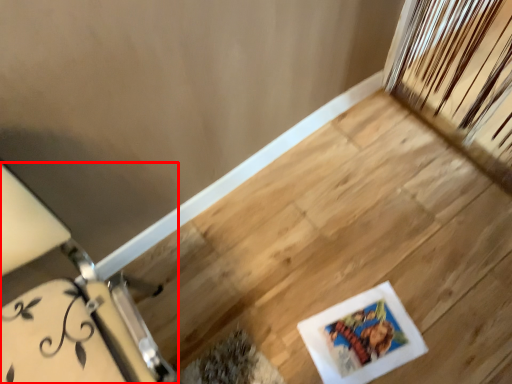
Question: From the image's perspective, considering the relative positions of furniture (annotated by the red box) and picture frame in the image provided, where is furniture (annotated by the red box) located with respect to the staircase?

Choices:
 (A) above
 (B) below

Answer: (A)